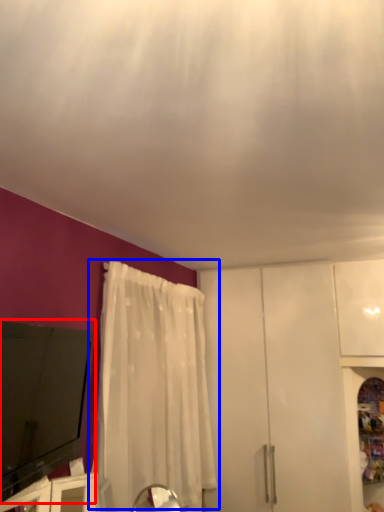
Question: Which object appears closest to the camera in this image, electronic (highlighted by a red box) or curtain (highlighted by a blue box)?

Choices:
 (A) electronic
 (B) curtain

Answer: (A)